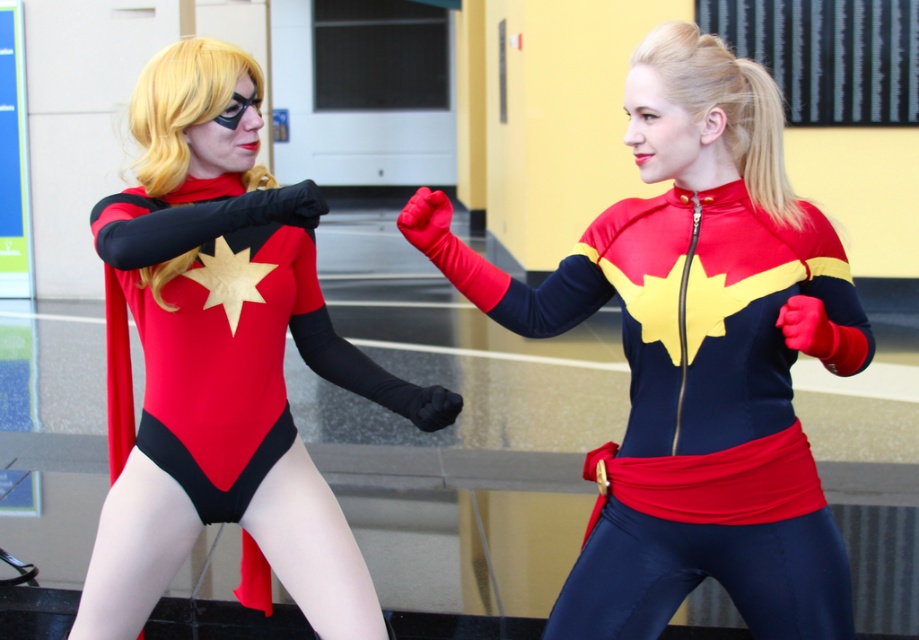
Question: Which object is closer to the camera taking this photo?

Choices:
 (A) matte black bodysuit at left
 (B) shiny spandex suit at center

Answer: (B)

Question: Which point is farther to the camera?

Choices:
 (A) matte black bodysuit at left
 (B) shiny spandex suit at center

Answer: (A)

Question: Does shiny spandex suit at center have a lesser width compared to matte black bodysuit at left?

Choices:
 (A) no
 (B) yes

Answer: (A)

Question: Does shiny spandex suit at center appear under matte black bodysuit at left?

Choices:
 (A) yes
 (B) no

Answer: (A)

Question: Does shiny spandex suit at center have a greater width compared to matte black bodysuit at left?

Choices:
 (A) no
 (B) yes

Answer: (B)

Question: Which of the following is the farthest from the observer?

Choices:
 (A) (286, 582)
 (B) (729, 196)

Answer: (A)